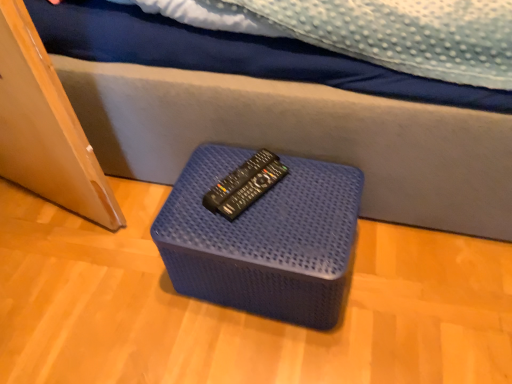
At what (x,y) coordinates should I click in order to perform the action: click on black plastic remote at center. Please return your answer as a coordinate pair (x, y). The width and height of the screenshot is (512, 384). Looking at the image, I should click on (237, 179).

Image resolution: width=512 pixels, height=384 pixels. Describe the element at coordinates (237, 179) in the screenshot. I see `black plastic remote at center` at that location.

The image size is (512, 384). What do you see at coordinates (264, 239) in the screenshot?
I see `blue woven ottoman at center` at bounding box center [264, 239].

Image resolution: width=512 pixels, height=384 pixels. Find the location of `blue woven ottoman at center`. blue woven ottoman at center is located at coordinates (264, 239).

Where is `black plastic remote at center`? black plastic remote at center is located at coordinates (237, 179).

Considering the positions of objects blue woven ottoman at center and black plastic remote at center in the image provided, who is more to the right, blue woven ottoman at center or black plastic remote at center?

blue woven ottoman at center.

Consider the image. Between blue woven ottoman at center and black plastic remote at center, which one is positioned behind?

black plastic remote at center is behind.

Is point (320, 210) positioned before point (245, 180)?

Yes, point (320, 210) is in front of point (245, 180).

From the image's perspective, which one is positioned higher, blue woven ottoman at center or black plastic remote at center?

black plastic remote at center, from the image's perspective.

From a real-world perspective, between blue woven ottoman at center and black plastic remote at center, who is vertically higher?

black plastic remote at center, from a real-world perspective.

Does blue woven ottoman at center have a lesser width compared to black plastic remote at center?

No, blue woven ottoman at center is not thinner than black plastic remote at center.

Between blue woven ottoman at center and black plastic remote at center, which one has less height?

black plastic remote at center.

Considering the sizes of objects blue woven ottoman at center and black plastic remote at center in the image provided, who is smaller, blue woven ottoman at center or black plastic remote at center?

Smaller between the two is black plastic remote at center.

Is black plastic remote at center inside blue woven ottoman at center?

No, black plastic remote at center is not surrounded by blue woven ottoman at center.

Are blue woven ottoman at center and black plastic remote at center making contact?

No, blue woven ottoman at center is not in contact with black plastic remote at center.

Is blue woven ottoman at center aimed at black plastic remote at center?

No, blue woven ottoman at center is not oriented towards black plastic remote at center.

How many degrees apart are the facing directions of blue woven ottoman at center and black plastic remote at center?

They differ by 28.1 degrees in their facing directions.

Find the location of a particular element. This screenshot has width=512, height=384. furniture below the black plastic remote at center (from a real-world perspective) is located at coordinates (264, 239).

Which is more to the left, black plastic remote at center or blue woven ottoman at center?

From the viewer's perspective, black plastic remote at center appears more on the left side.

Who is more distant, black plastic remote at center or blue woven ottoman at center?

Positioned behind is black plastic remote at center.

Which is more distant, (262,165) or (169,207)?

The point (262,165) is behind.

From the image's perspective, is black plastic remote at center under blue woven ottoman at center?

Actually, black plastic remote at center appears above blue woven ottoman at center in the image.

From a real-world perspective, who is located lower, black plastic remote at center or blue woven ottoman at center?

blue woven ottoman at center, from a real-world perspective.

Between black plastic remote at center and blue woven ottoman at center, which one has larger width?

Wider between the two is blue woven ottoman at center.

Which of these two, black plastic remote at center or blue woven ottoman at center, stands taller?

blue woven ottoman at center is taller.

Which of these two, black plastic remote at center or blue woven ottoman at center, is bigger?

blue woven ottoman at center.

Would you say black plastic remote at center contains blue woven ottoman at center?

No.

Is black plastic remote at center far from blue woven ottoman at center?

Actually, black plastic remote at center and blue woven ottoman at center are a little close together.

Is black plastic remote at center facing away from blue woven ottoman at center?

black plastic remote at center does not have its back to blue woven ottoman at center.

How different are the orientations of black plastic remote at center and blue woven ottoman at center in degrees?

28.1 degrees.

Measure the distance between black plastic remote at center and blue woven ottoman at center.

6.18 inches.

Where is `remote on the left of blue woven ottoman at center`? remote on the left of blue woven ottoman at center is located at coordinates (237, 179).

I want to click on remote lying on the left of blue woven ottoman at center, so click(237, 179).

You are a GUI agent. You are given a task and a screenshot of the screen. Output one action in this format:
    pyautogui.click(x=<x>, y=<y>)
    Task: Click on the remote behind the blue woven ottoman at center
    This screenshot has width=512, height=384.
    Given the screenshot: What is the action you would take?
    pyautogui.click(x=237, y=179)